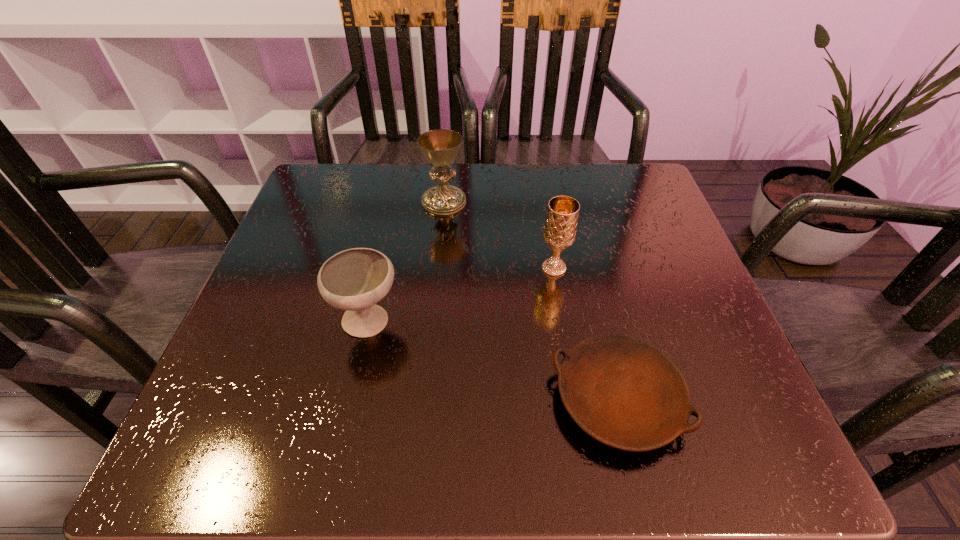
The image size is (960, 540). What are the coordinates of `blank region between the leftmost chalice and the plate` in the screenshot? It's located at (492, 361).

At what (x,y) coordinates should I click in order to perform the action: click on free space between the leftmost chalice and the third nearest object. Please return your answer as a coordinate pair (x, y). Looking at the image, I should click on tap(462, 295).

The height and width of the screenshot is (540, 960). In order to click on blank region between the third object from right to left and the second shortest object in this screenshot , I will do `click(406, 262)`.

Identify the location of object that is the second closest to the third nearest object. (440, 147).

Select which object is the second closest to the plate. Please provide its 2D coordinates. Your answer should be formatted as a tuple, i.e. [(x, y)], where the tuple contains the x and y coordinates of a point satisfying the conditions above.

[(356, 279)]

Identify the location of chalice that is the second closest to the third tallest object. (x=560, y=227).

Choose which chalice is the nearest neighbor to the third nearest object. Please provide its 2D coordinates. Your answer should be formatted as a tuple, i.e. [(x, y)], where the tuple contains the x and y coordinates of a point satisfying the conditions above.

[(440, 147)]

At what (x,y) coordinates should I click in order to perform the action: click on free location that satisfies the following two spatial constraints: 1. on the front side of the leftmost object; 2. on the left side of the shortest object. Please return your answer as a coordinate pair (x, y). Image resolution: width=960 pixels, height=540 pixels. Looking at the image, I should click on (351, 400).

The height and width of the screenshot is (540, 960). I want to click on vacant space that satisfies the following two spatial constraints: 1. on the front side of the plate; 2. on the right side of the second farthest object, so click(575, 400).

The image size is (960, 540). I want to click on free point that satisfies the following two spatial constraints: 1. on the front side of the shortest object; 2. on the right side of the rightmost chalice, so click(575, 400).